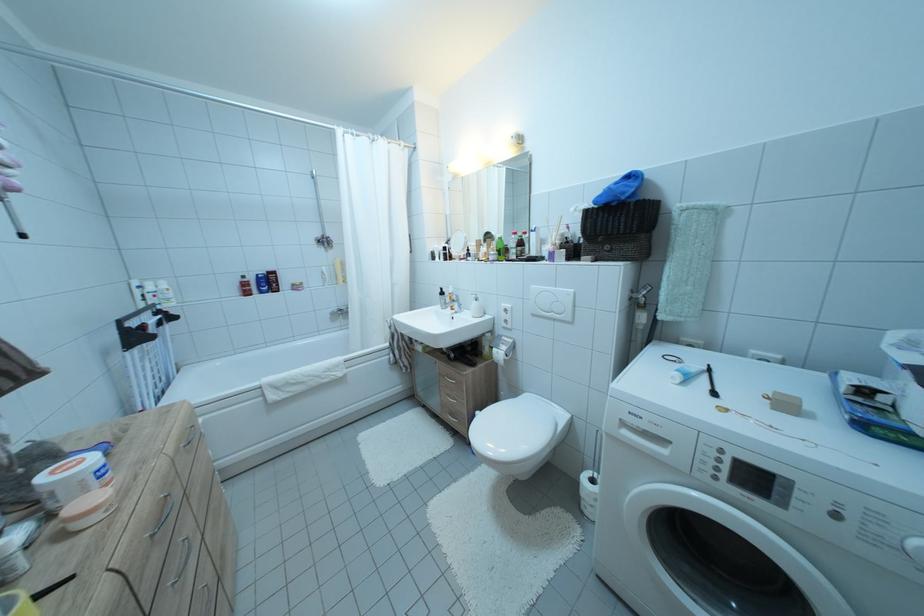
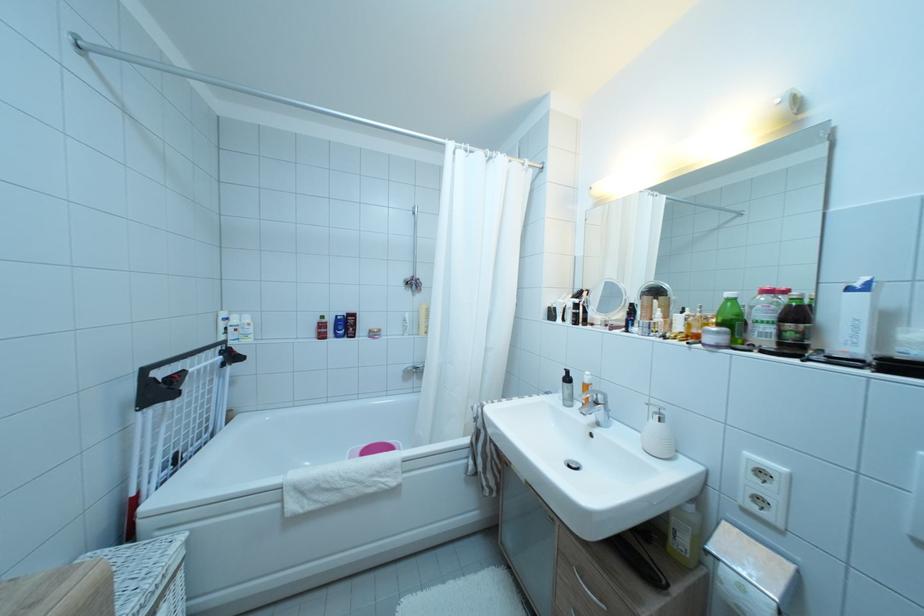
The point at [247,285] is marked in the first image. Where is the corresponding point in the second image?

(324, 325)